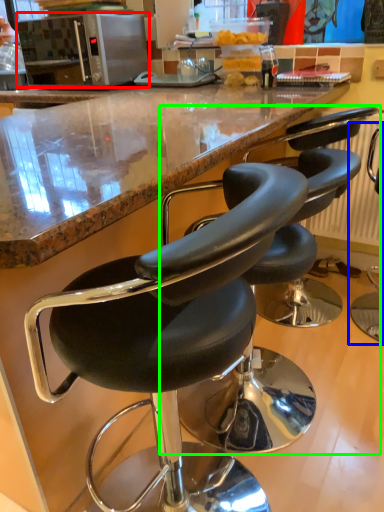
Question: Based on their relative distances, which object is farther from microwave oven (highlighted by a red box)? Choose from chair (highlighted by a blue box) and chair (highlighted by a green box).

Choices:
 (A) chair
 (B) chair

Answer: (B)